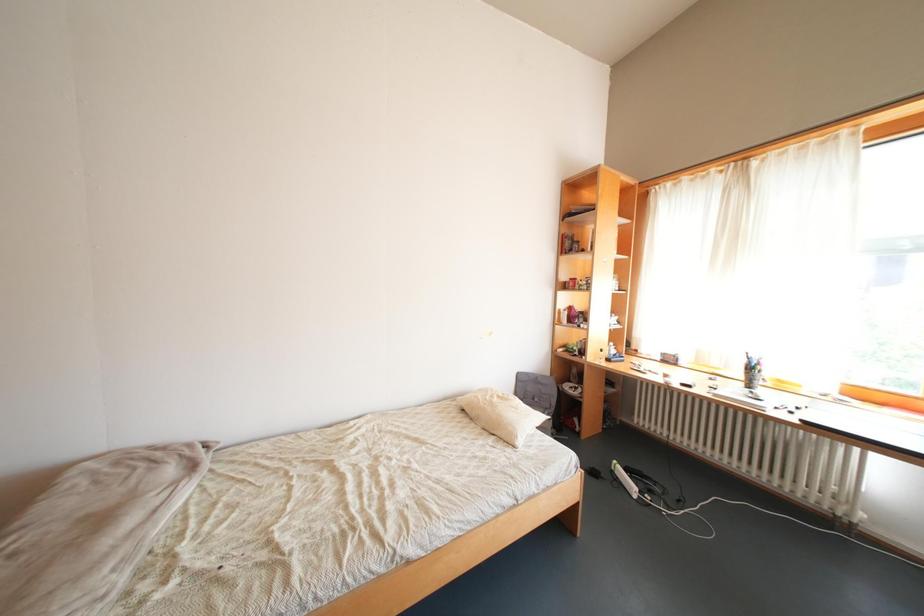
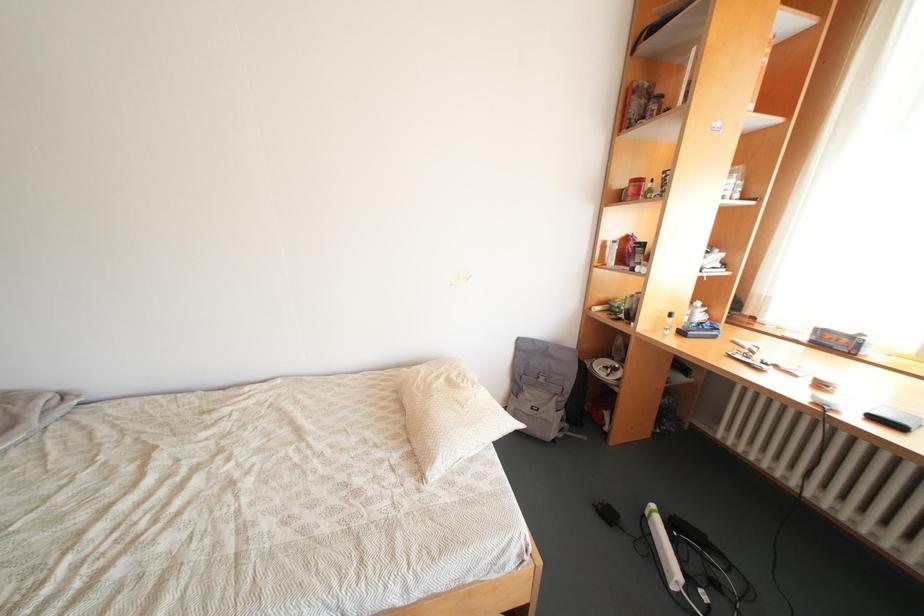
Question: Based on the continuous images, in which direction is the camera rotating? Reply with the corresponding letter.

Choices:
 (A) Left
 (B) Right
 (C) Up
 (D) Down

Answer: (A)